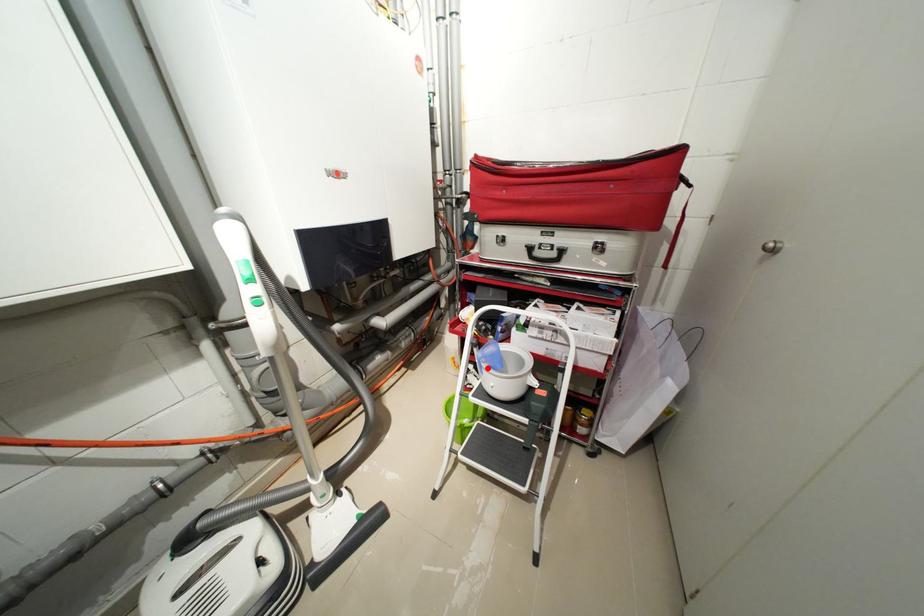
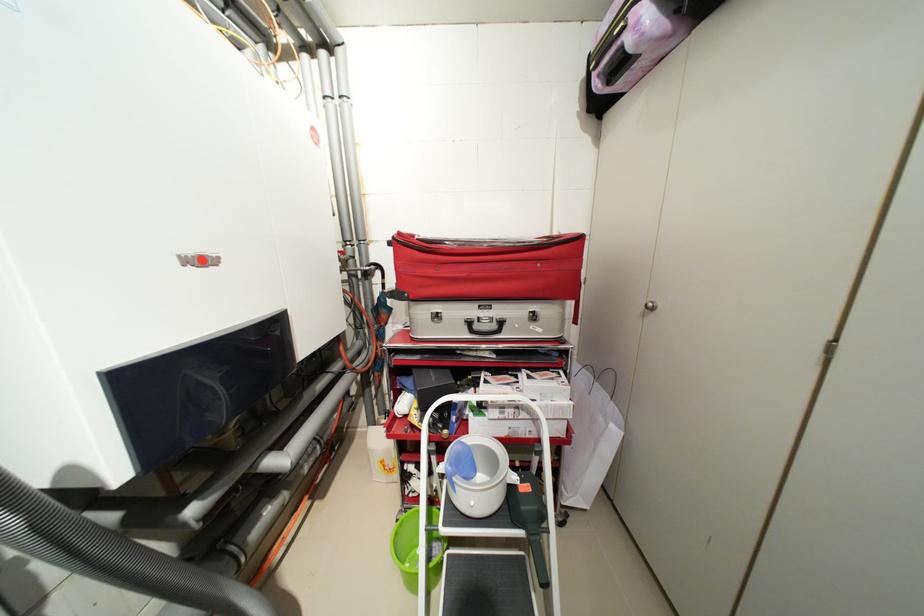
Locate, in the second image, the point that corresponds to the highlighted location in the first image.

(459, 485)